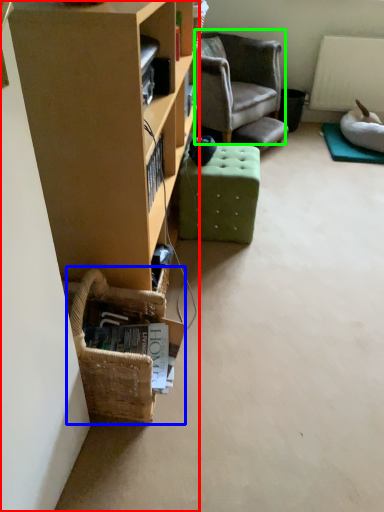
Question: Considering the real-world distances, which object is closest to cabinetry (highlighted by a red box)? basket (highlighted by a blue box) or chair (highlighted by a green box).

Choices:
 (A) basket
 (B) chair

Answer: (A)